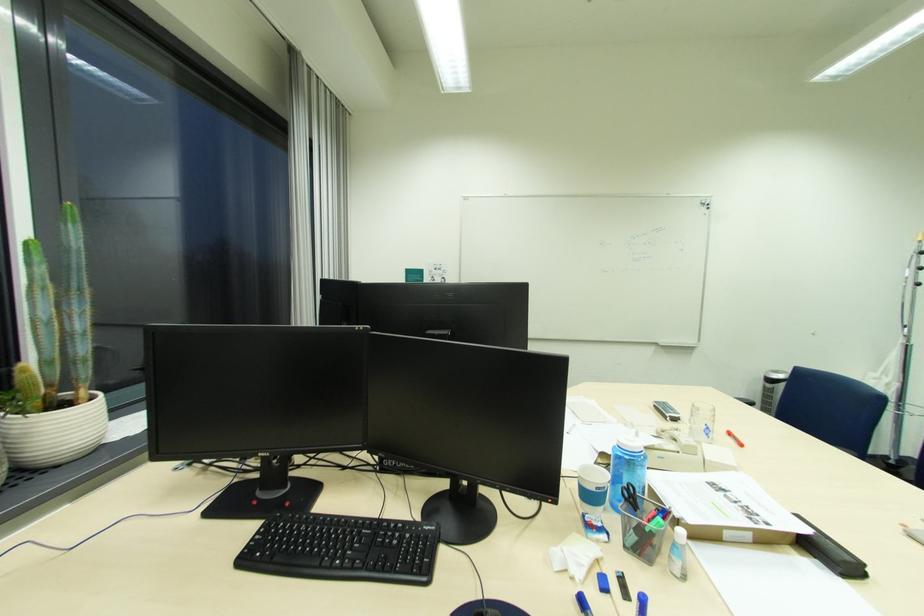
I want to click on telephone handset, so click(831, 553).